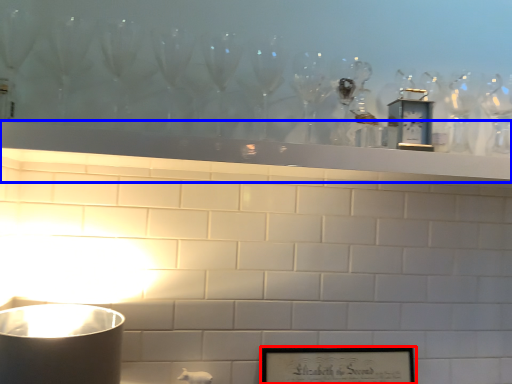
Question: Which object is further to the camera taking this photo, picture frame (highlighted by a red box) or mantle (highlighted by a blue box)?

Choices:
 (A) picture frame
 (B) mantle

Answer: (A)